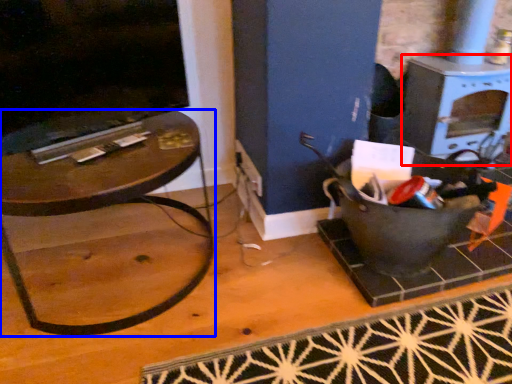
Question: Which point is further to the camera, stove (highlighted by a red box) or table (highlighted by a blue box)?

Choices:
 (A) stove
 (B) table

Answer: (A)